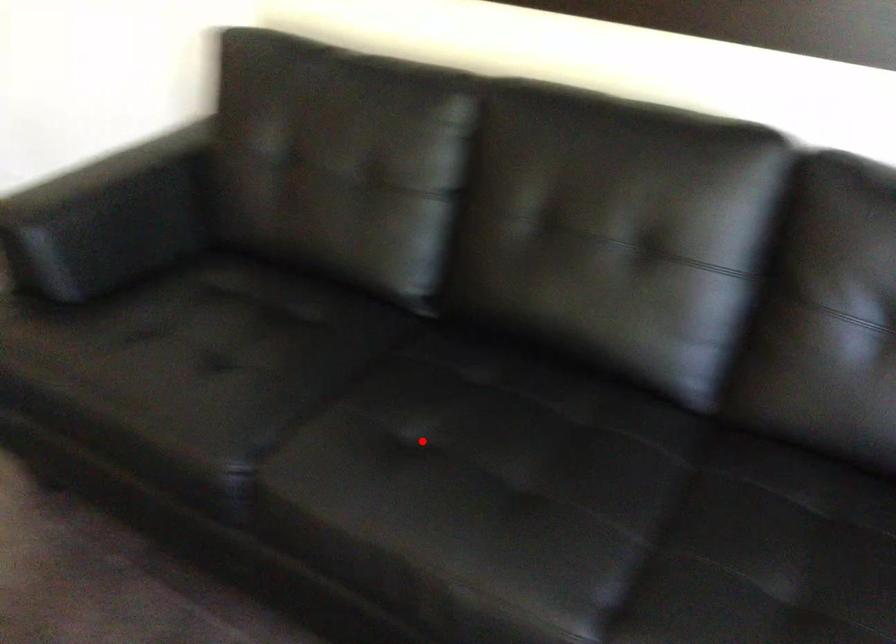
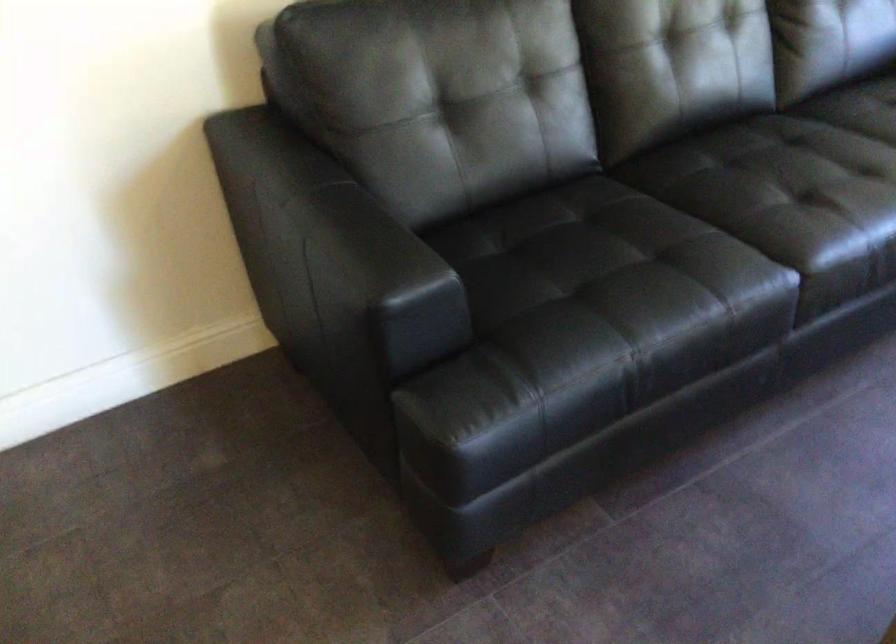
Find the pixel in the second image that matches the highlighted location in the first image.

(788, 200)